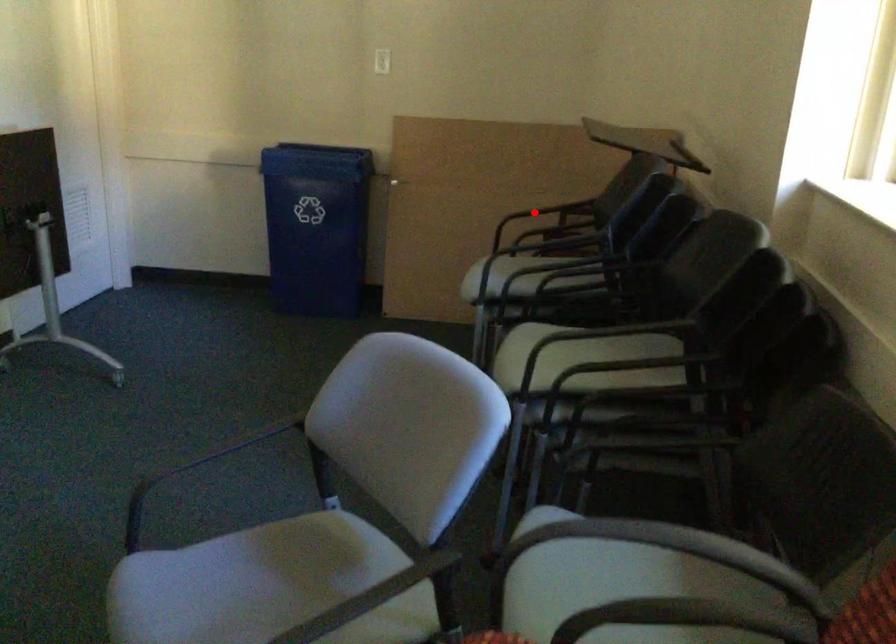
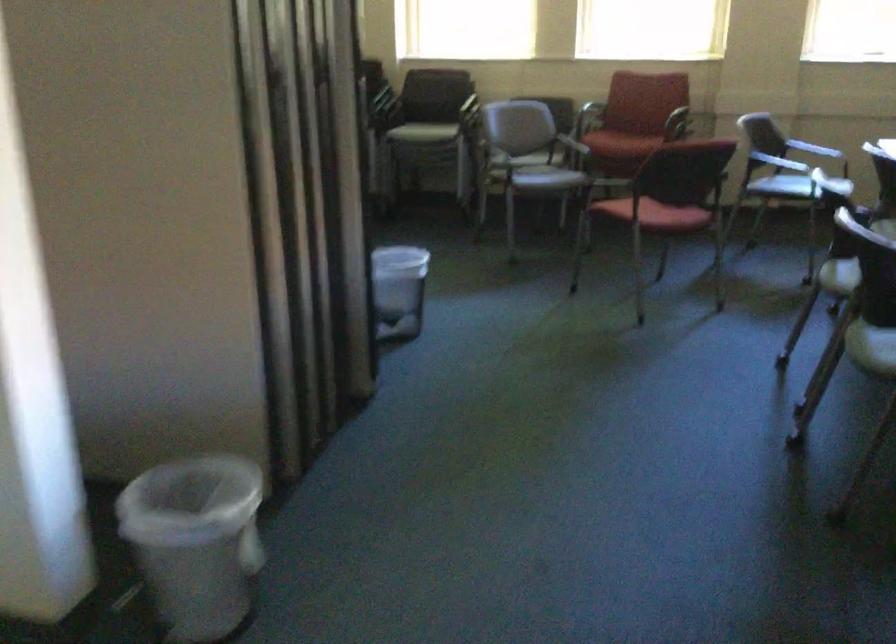
Question: I am providing you with two images of the same scene from different viewpoints. A red point is marked on the first image. At the location where the point appears in image 1, is it still visible in image 2?

Choices:
 (A) Yes
 (B) No

Answer: (B)